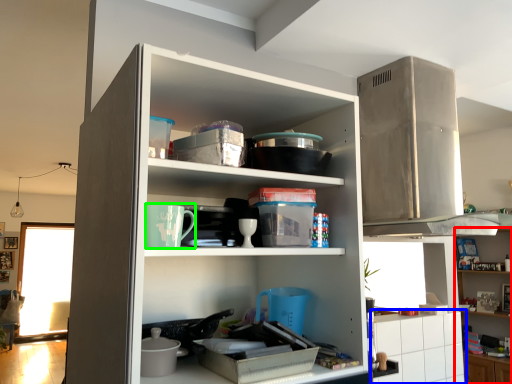
Question: Based on their relative distances, which object is farther from cabinet (highlighted by a red box)? Choose from cabinetry (highlighted by a blue box) and appliance (highlighted by a green box).

Choices:
 (A) cabinetry
 (B) appliance

Answer: (B)